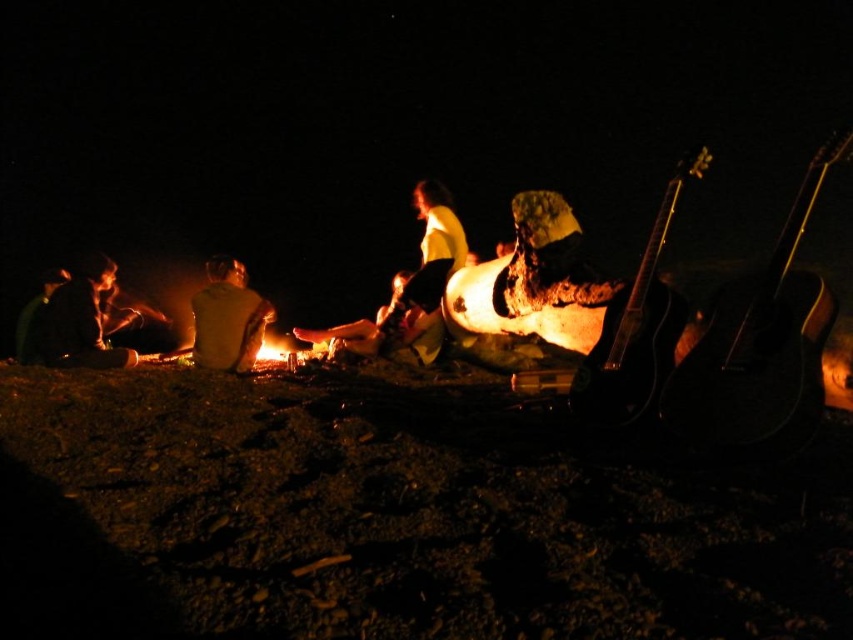
You are standing at the campfire and want to grab the charcoal gray firewood at lower left. Can you reach it without moving from your current position?

The charcoal gray firewood at lower left is 4.90 meters away from the viewer. Since the average human arm length is about 0.7 meters, you cannot reach it without moving.

You are standing at the point marked by the coordinates point (x=79, y=321). Looking around, you see the image described. What object is located at your current position?

The point (x=79, y=321) indicates the location of the charcoal gray firewood at lower left.

You are standing at the origin point of the coordinate system, which is at the bottom left corner of the image. You want to place a new piece of firewood exactly 0.1 units to the right of the charcoal gray firewood at lower left. What are the coordinates of the new position?

The charcoal gray firewood at lower left is at point (79, 321). Adding 0.1 to the x coordinate gives 0.603, so the new position is at (79, 385).